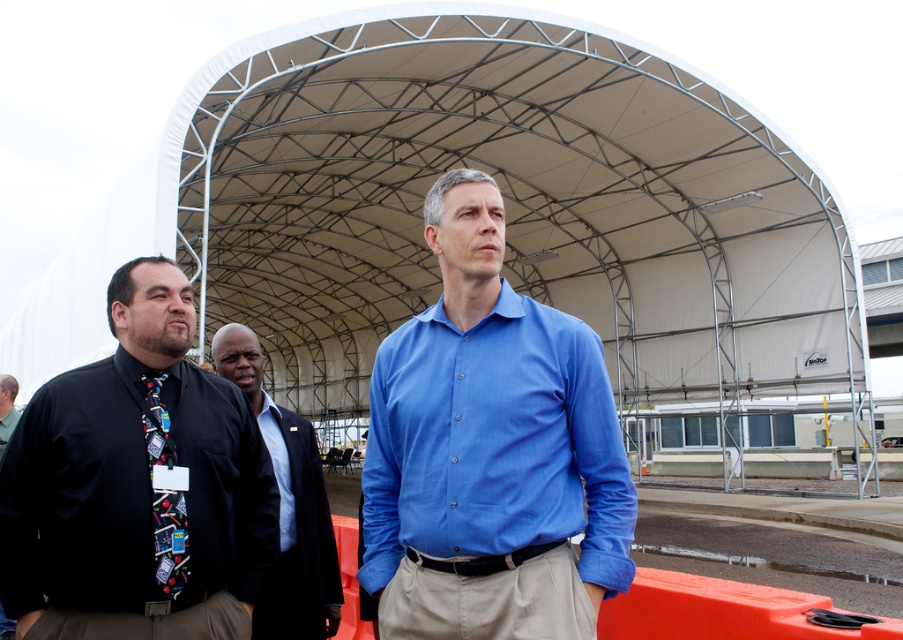
Is blue cotton shirt at center thinner than light blue cotton shirt at center?

No, blue cotton shirt at center is not thinner than light blue cotton shirt at center.

Who is higher up, blue cotton shirt at center or light blue cotton shirt at center?

Positioned higher is blue cotton shirt at center.

This screenshot has width=903, height=640. What are the coordinates of `blue cotton shirt at center` in the screenshot? It's located at (490, 451).

Identify the location of blue cotton shirt at center. (490, 451).

Is multicolored fabric tie at left smaller than black tie at left?

Indeed, multicolored fabric tie at left has a smaller size compared to black tie at left.

Can you confirm if multicolored fabric tie at left is bigger than black tie at left?

Actually, multicolored fabric tie at left might be smaller than black tie at left.

What do you see at coordinates (164, 492) in the screenshot? I see `multicolored fabric tie at left` at bounding box center [164, 492].

Locate an element on the screen. Image resolution: width=903 pixels, height=640 pixels. multicolored fabric tie at left is located at coordinates (164, 492).

Which is above, black matte shirt at left or multicolored fabric tie at left?

black matte shirt at left is above.

Between black matte shirt at left and multicolored fabric tie at left, which one appears on the right side from the viewer's perspective?

From the viewer's perspective, multicolored fabric tie at left appears more on the right side.

Between point (143, 570) and point (178, 499), which one is positioned behind?

The point (178, 499) is behind.

Where is `black matte shirt at left`? black matte shirt at left is located at coordinates (135, 476).